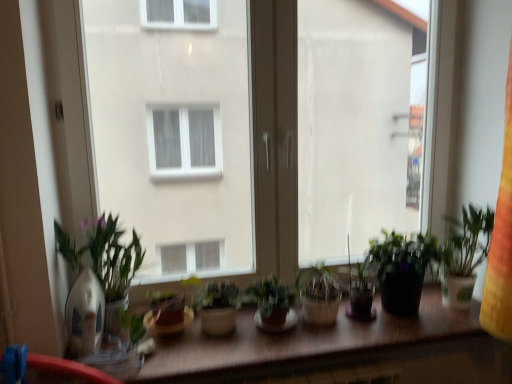
Question: From the image's perspective, does wooden table at center appear higher than green matte plant at center, which is counted as the third houseplant, starting from the right?

Choices:
 (A) yes
 (B) no

Answer: (B)

Question: From the image's perspective, does wooden table at center appear lower than green matte plant at center, positioned as the 2th houseplant in left-to-right order?

Choices:
 (A) yes
 (B) no

Answer: (A)

Question: Is green matte plant at center, positioned as the 2th houseplant in left-to-right order, surrounded by wooden table at center?

Choices:
 (A) no
 (B) yes

Answer: (A)

Question: Considering the relative sizes of wooden table at center and green matte plant at center, positioned as the 2th houseplant in left-to-right order, in the image provided, is wooden table at center shorter than green matte plant at center, positioned as the 2th houseplant in left-to-right order,?

Choices:
 (A) yes
 (B) no

Answer: (A)

Question: Is wooden table at center facing towards green matte plant at center, positioned as the 2th houseplant in left-to-right order?

Choices:
 (A) no
 (B) yes

Answer: (A)

Question: Looking at the image, does green matte plant at center, which is counted as the 3th houseplant, starting from the left, seem bigger or smaller compared to transparent glass window at center?

Choices:
 (A) small
 (B) big

Answer: (A)

Question: From a real-world perspective, is green matte plant at center, which is the 2th houseplant from right to left, physically located above or below transparent glass window at center?

Choices:
 (A) above
 (B) below

Answer: (B)

Question: Is green matte plant at center, which is counted as the 3th houseplant, starting from the left, in front of or behind transparent glass window at center in the image?

Choices:
 (A) front
 (B) behind

Answer: (A)

Question: Based on their positions, is green matte plant at center, which is the 2th houseplant from right to left, located to the left or right of transparent glass window at center?

Choices:
 (A) left
 (B) right

Answer: (A)

Question: Based on their sizes in the image, would you say transparent plastic window screen at center, which is the 1th window screen in right-to-left order, is bigger or smaller than green matte plant at center, which is counted as the third houseplant, starting from the right?

Choices:
 (A) small
 (B) big

Answer: (B)

Question: Would you say transparent plastic window screen at center, which is the 1th window screen in right-to-left order, is to the left or to the right of green matte plant at center, positioned as the 2th houseplant in left-to-right order, in the picture?

Choices:
 (A) right
 (B) left

Answer: (A)

Question: From a real-world perspective, is transparent plastic window screen at center, acting as the 2th window screen starting from the left, above or below green matte plant at center, positioned as the 2th houseplant in left-to-right order?

Choices:
 (A) below
 (B) above

Answer: (B)

Question: From the image's perspective, is transparent plastic window screen at center, acting as the 2th window screen starting from the left, above or below green matte plant at center, which is counted as the third houseplant, starting from the right?

Choices:
 (A) above
 (B) below

Answer: (A)

Question: Based on their sizes in the image, would you say transparent plastic window screen at center, acting as the 2th window screen starting from the left, is bigger or smaller than matte brown pot at center, which is the 1th houseplant from left to right?

Choices:
 (A) small
 (B) big

Answer: (B)

Question: Considering the positions of transparent plastic window screen at center, acting as the 2th window screen starting from the left, and matte brown pot at center, which is the 1th houseplant from left to right, in the image, is transparent plastic window screen at center, acting as the 2th window screen starting from the left, wider or thinner than matte brown pot at center, which is the 1th houseplant from left to right,?

Choices:
 (A) thin
 (B) wide

Answer: (A)